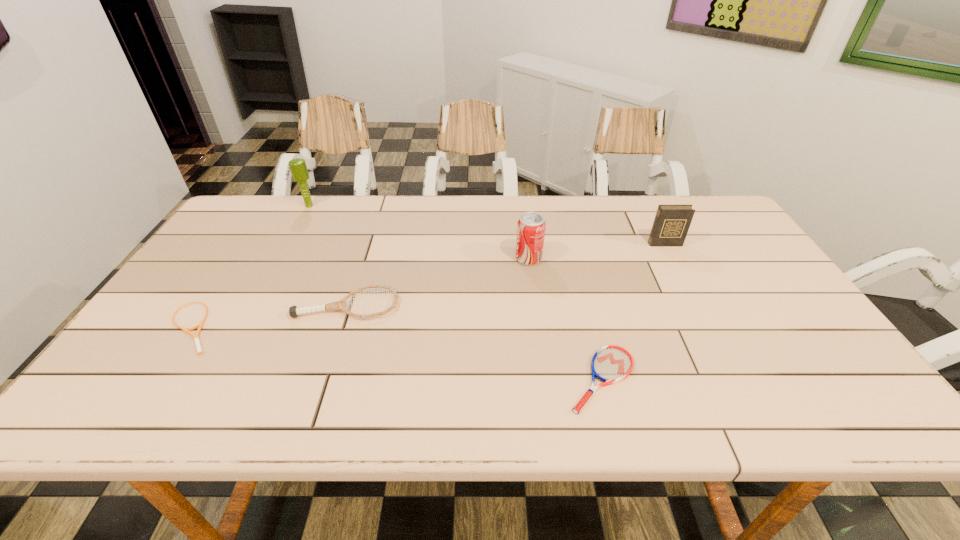
Locate an element on the screen. unoccupied area between the diary and the fifth tallest object is located at coordinates (634, 312).

You are a GUI agent. You are given a task and a screenshot of the screen. Output one action in this format:
    pyautogui.click(x=<x>, y=<y>)
    Task: Click on the free area in between the third farthest object and the second farthest object
    Image resolution: width=960 pixels, height=540 pixels.
    Given the screenshot: What is the action you would take?
    pyautogui.click(x=596, y=251)

Locate an element on the screen. This screenshot has width=960, height=540. free area in between the leftmost object and the fourth nearest object is located at coordinates (360, 293).

Locate an element on the screen. Image resolution: width=960 pixels, height=540 pixels. free space that is in between the diary and the fifth object from left to right is located at coordinates (634, 312).

The width and height of the screenshot is (960, 540). What are the coordinates of `empty location between the second object from left to right and the second tennis racket from left to right` in the screenshot? It's located at (328, 255).

I want to click on vacant area that lies between the farthest object and the leftmost tennis racket, so click(251, 266).

Where is `vacant space in between the fifth object from right to left and the leftmost tennis racket`? Image resolution: width=960 pixels, height=540 pixels. vacant space in between the fifth object from right to left and the leftmost tennis racket is located at coordinates (251, 266).

The width and height of the screenshot is (960, 540). I want to click on empty space between the tallest tennis racket and the second tallest tennis racket, so click(x=474, y=342).

Image resolution: width=960 pixels, height=540 pixels. Identify the location of the fifth closest object relative to the shortest object. (671, 224).

Identify the location of object identified as the closest to the second shortest tennis racket. click(531, 226).